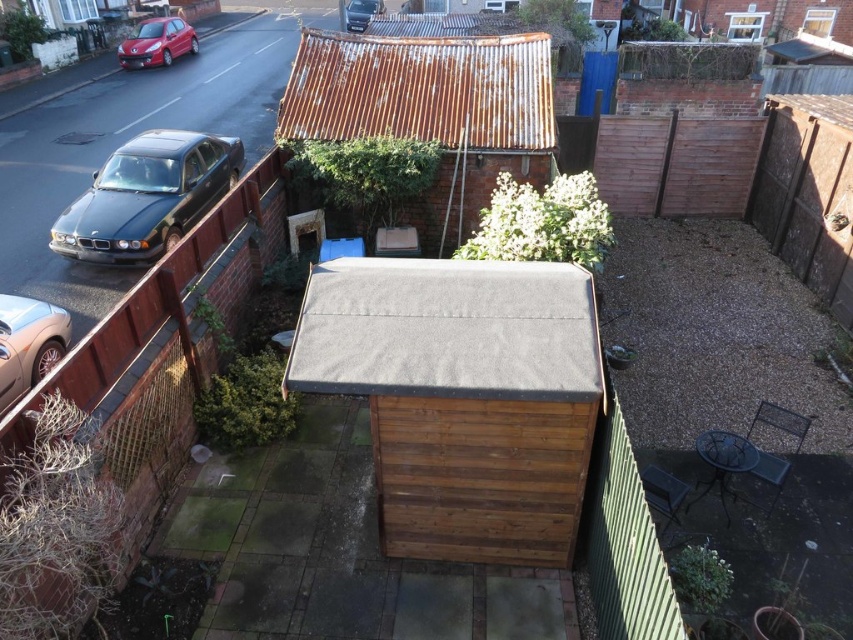
You are a delivery person standing at the entrance of the backyard. You need to park your van, which is 3 meters long, between the matte black car at left and the metallic gold car at left. Is there enough space between them to park your van?

The matte black car at left is 3.15 meters away from the metallic gold car at left. Since your van is 3 meters long, there is sufficient space between them to park your van.

You are standing at the point indicated by point (28, 342) in the image. What object is directly in front of you?

The metallic gold car at left is directly in front of you at point (28, 342).

You are standing in the backyard looking towards the shed. You see a metallic gold car at left and a shiny red car at upper left. Which car is positioned more to the right side of the scene?

The metallic gold car at left is positioned more to the right side of the scene compared to the shiny red car at upper left.